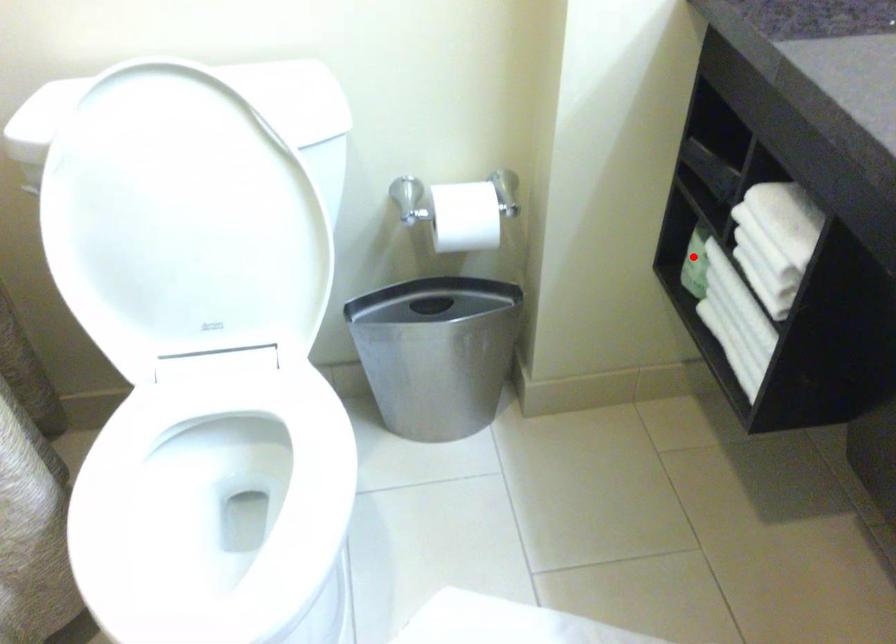
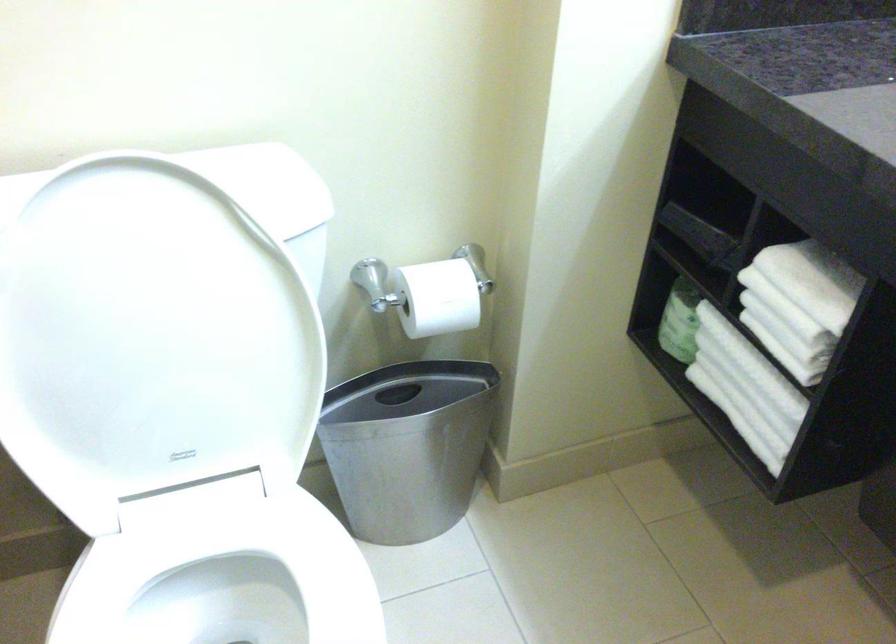
In the second image, find the point that corresponds to the highlighted location in the first image.

(679, 321)